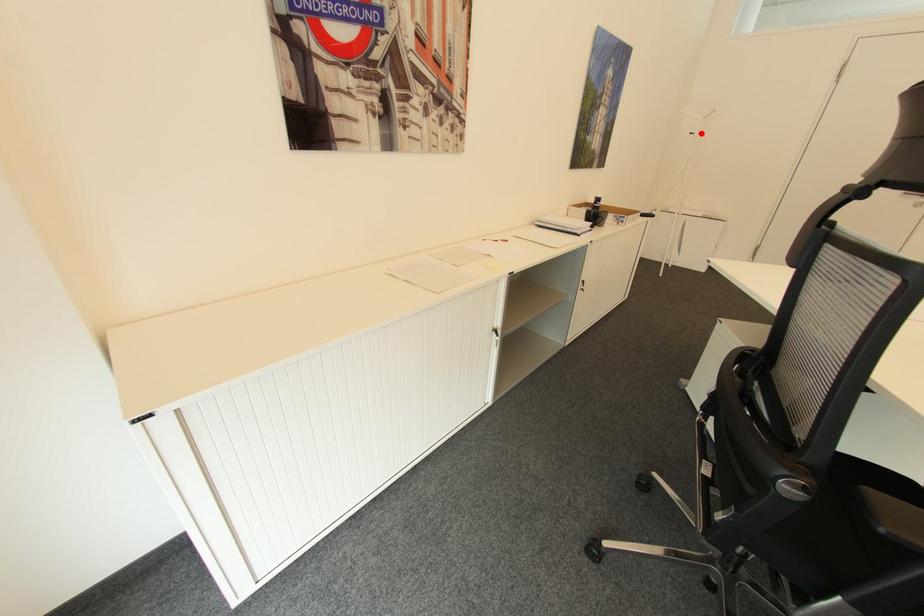
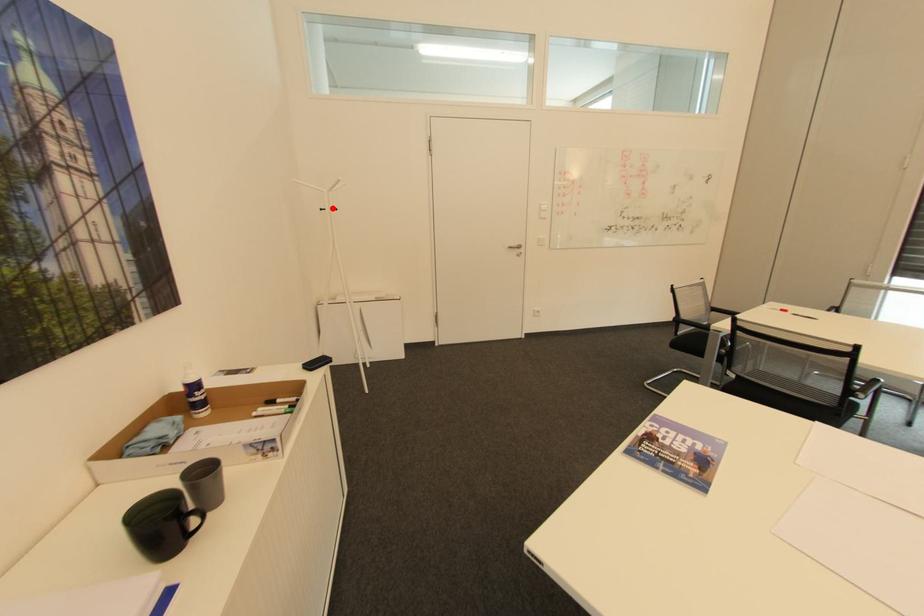
Looking at this image, I am providing you with two images of the same scene from different viewpoints. A red point is marked on the first image and another point is marked on the second image. Are the points marked in image1 and image2 representing the same 3D position?

Yes